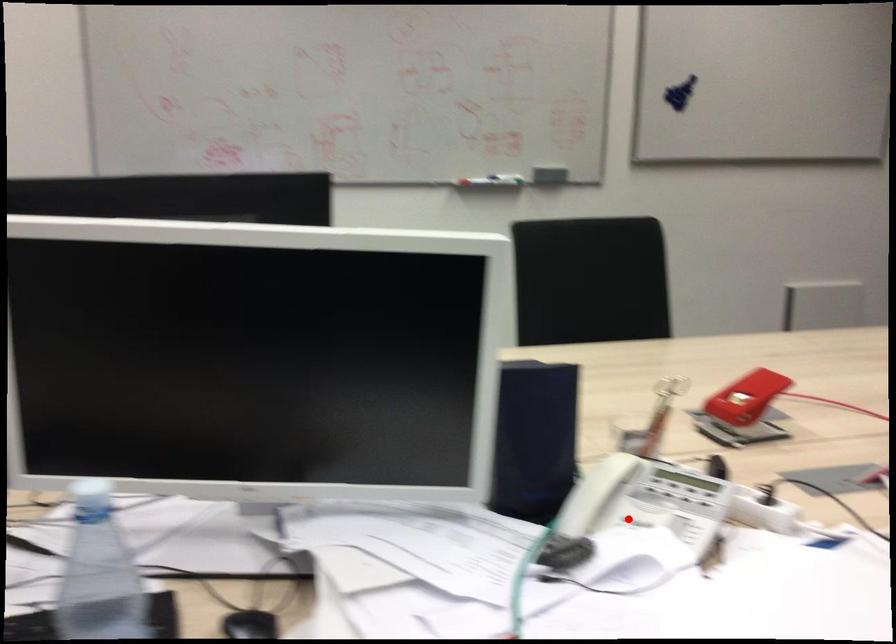
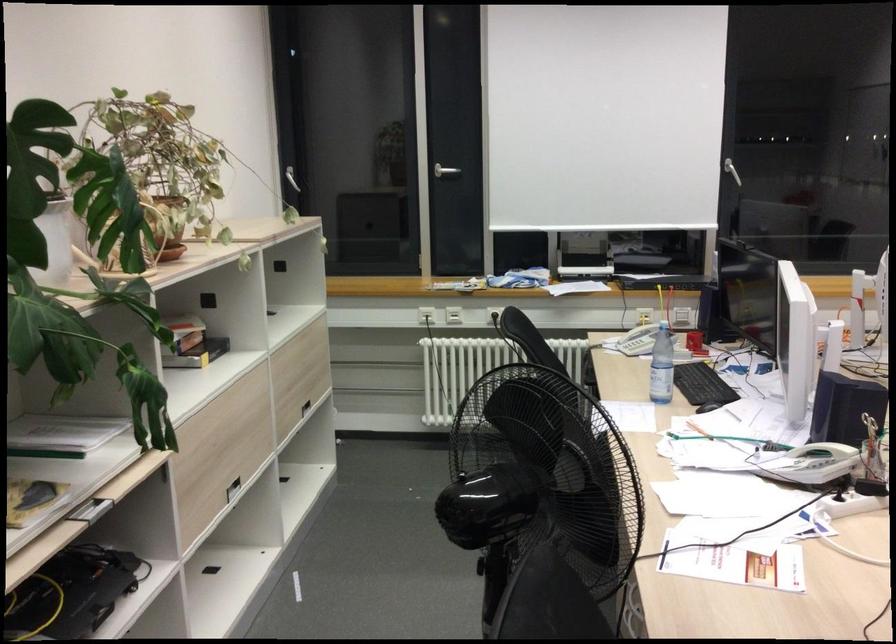
Question: I am providing you with two images of the same scene from different viewpoints. A red point is shown in image1. For the corresponding object point in image2, is it positioned nearer or farther from the camera?

Choices:
 (A) Nearer
 (B) Farther

Answer: (B)